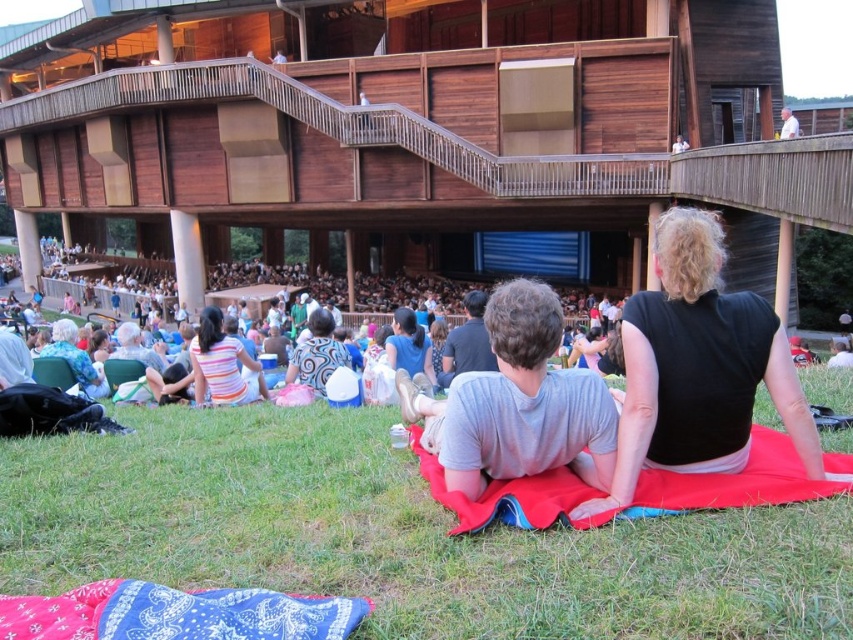
Does gray cotton shirt at center appear under blue paisley fabric at lower center?

No.

Who is positioned more to the right, gray cotton shirt at center or blue paisley fabric at lower center?

From the viewer's perspective, gray cotton shirt at center appears more on the right side.

Consider the image. Measure the distance between gray cotton shirt at center and camera.

gray cotton shirt at center is 18.40 meters from camera.

The image size is (853, 640). Identify the location of gray cotton shirt at center. (517, 403).

Who is lower down, gray cotton shirt at center or wooden balcony at upper center?

gray cotton shirt at center

Which is behind, point (606, 483) or point (674, 144)?

Point (674, 144)

Which is in front, point (543, 397) or point (685, 145)?

Point (543, 397) is in front.

Identify the location of gray cotton shirt at center. The height and width of the screenshot is (640, 853). (517, 403).

Does red fabric blanket at lower center appear over white shirt at upper right?

Actually, red fabric blanket at lower center is below white shirt at upper right.

Between point (776, 458) and point (780, 113), which one is positioned behind?

Positioned behind is point (780, 113).

Locate an element on the screen. This screenshot has width=853, height=640. red fabric blanket at lower center is located at coordinates (726, 484).